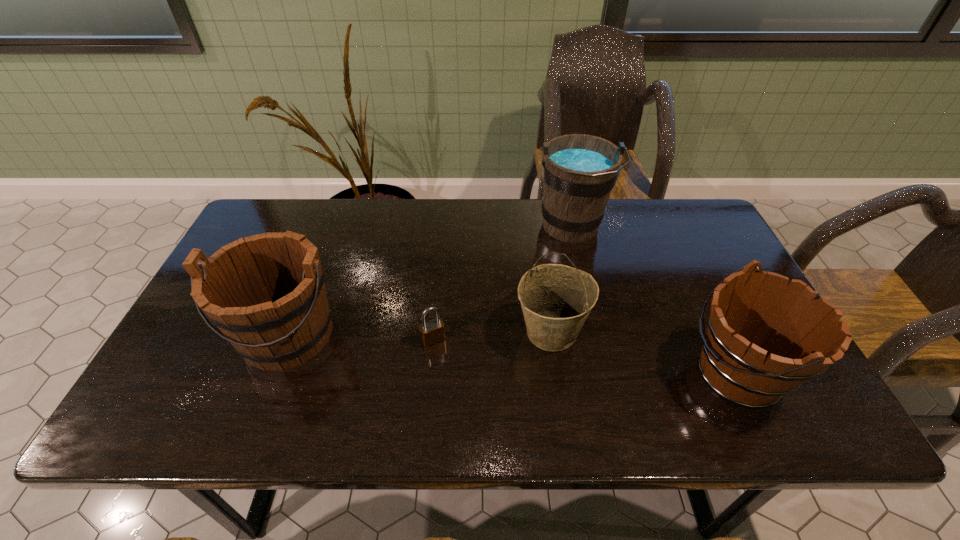
In the image, there is a desktop. Where is `free space at the far right corner`? The height and width of the screenshot is (540, 960). free space at the far right corner is located at coordinates (671, 217).

Where is `vacant space in between the farthest wine bucket and the rightmost wine bucket`? The height and width of the screenshot is (540, 960). vacant space in between the farthest wine bucket and the rightmost wine bucket is located at coordinates (654, 300).

Locate an element on the screen. free spot between the padlock and the rightmost object is located at coordinates point(585,356).

You are a GUI agent. You are given a task and a screenshot of the screen. Output one action in this format:
    pyautogui.click(x=<x>, y=<y>)
    Task: Click on the free space that is in between the second object from left to right and the leftmost wine bucket
    This screenshot has width=960, height=540.
    Given the screenshot: What is the action you would take?
    pyautogui.click(x=361, y=336)

You are a GUI agent. You are given a task and a screenshot of the screen. Output one action in this format:
    pyautogui.click(x=<x>, y=<y>)
    Task: Click on the free spot between the second object from left to right and the rightmost object
    
    Given the screenshot: What is the action you would take?
    pyautogui.click(x=585, y=356)

Image resolution: width=960 pixels, height=540 pixels. I want to click on free area in between the shortest object and the farthest object, so click(x=502, y=284).

The width and height of the screenshot is (960, 540). I want to click on unoccupied area between the fourth object from right to left and the leftmost object, so click(361, 336).

Where is `object that ranks as the fourth closest to the leftmost object`? The width and height of the screenshot is (960, 540). object that ranks as the fourth closest to the leftmost object is located at coordinates (765, 336).

I want to click on the closest object to the farthest object, so click(556, 299).

Identify the location of the third closest wine bucket relative to the farthest wine bucket. (266, 293).